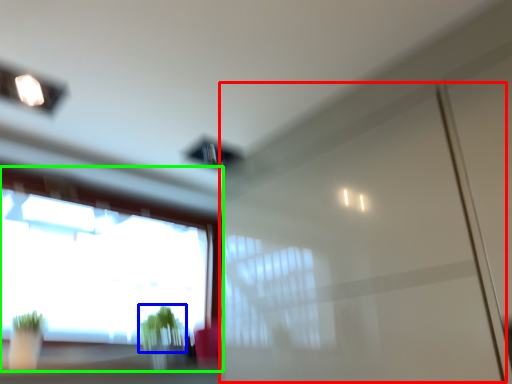
Question: Estimate the real-world distances between objects in this image. Which object is farther from screen door (highlighted by a red box), plant (highlighted by a blue box) or window (highlighted by a green box)?

Choices:
 (A) plant
 (B) window

Answer: (B)